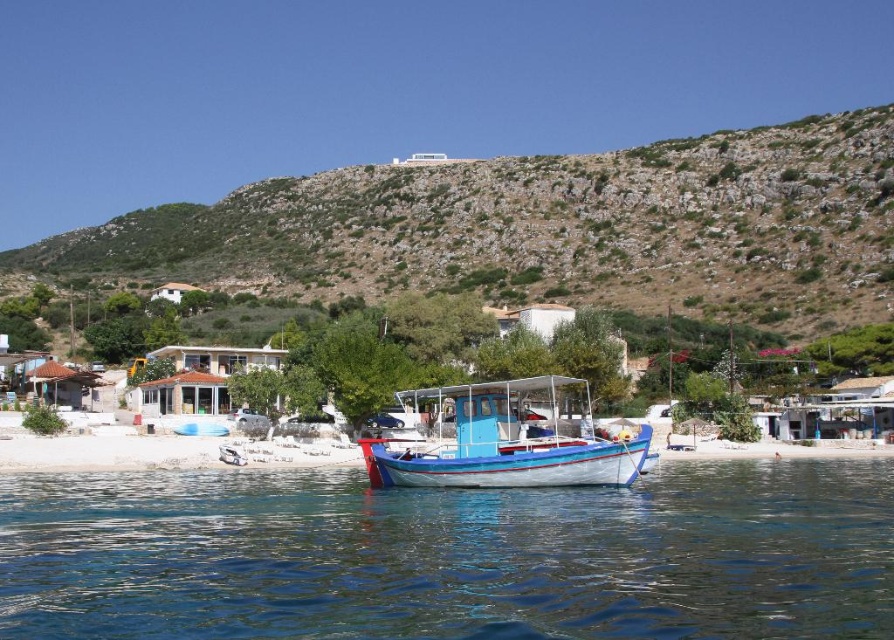
Question: Which object is closer to the camera taking this photo?

Choices:
 (A) white sand beach at lower center
 (B) brown rocky hillside at upper center
 (C) blue painted wooden boat at center

Answer: (C)

Question: Estimate the real-world distances between objects in this image. Which object is closer to the white sand beach at lower center?

Choices:
 (A) clear blue water at center
 (B) brown rocky hillside at upper center

Answer: (A)

Question: Is clear blue water at center above white sand beach at lower center?

Choices:
 (A) yes
 (B) no

Answer: (B)

Question: Does clear blue water at center appear under blue painted wooden boat at center?

Choices:
 (A) yes
 (B) no

Answer: (A)

Question: Is clear blue water at center below blue painted wooden boat at center?

Choices:
 (A) yes
 (B) no

Answer: (A)

Question: Which object is closer to the camera taking this photo?

Choices:
 (A) blue painted wooden boat at center
 (B) clear blue water at center
 (C) brown rocky hillside at upper center

Answer: (B)